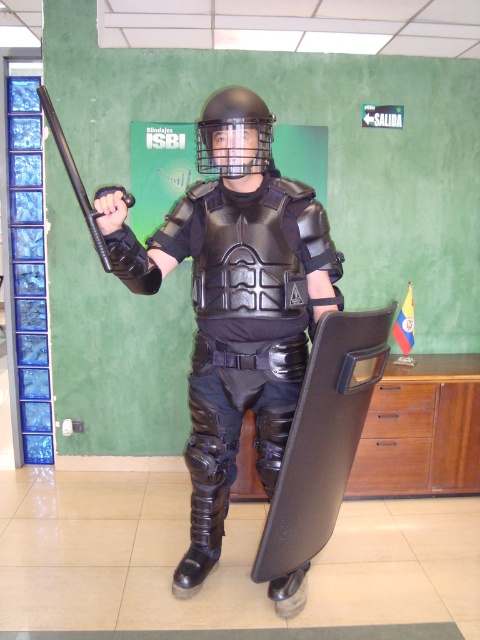
Question: Is matte black armor at center below matte black helmet at center?

Choices:
 (A) no
 (B) yes

Answer: (B)

Question: Which point is closer to the camera?

Choices:
 (A) (95, 236)
 (B) (162, 253)

Answer: (A)

Question: Considering the relative positions of matte black armor at center and matte black helmet at center in the image provided, where is matte black armor at center located with respect to matte black helmet at center?

Choices:
 (A) above
 (B) below

Answer: (B)

Question: Where is matte black armor at center located in relation to black rubber baton at left in the image?

Choices:
 (A) left
 (B) right

Answer: (B)

Question: Which object appears farthest from the camera in this image?

Choices:
 (A) matte black armor at center
 (B) black rubber baton at left
 (C) matte black helmet at center

Answer: (C)

Question: Among these objects, which one is nearest to the camera?

Choices:
 (A) matte black armor at center
 (B) matte black helmet at center
 (C) black rubber baton at left

Answer: (C)